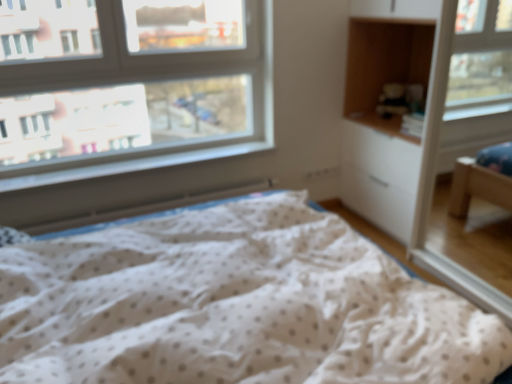
Identify the location of free space above white plastic window sill at lower left (from a real-world perspective). The image size is (512, 384). (144, 159).